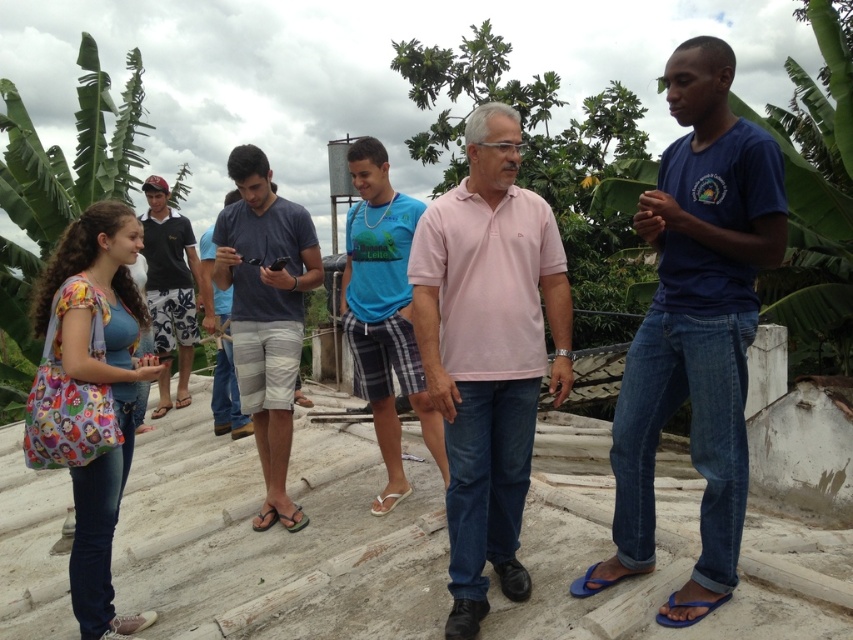
Is dark blue cotton shirt at center in front of blue plaid shorts at center?

No, dark blue cotton shirt at center is further to the viewer.

Is point (268, 307) in front of point (381, 224)?

No, it is behind (381, 224).

Which is in front, point (263, 412) or point (389, 460)?

Positioned in front is point (263, 412).

I want to click on dark blue cotton shirt at center, so click(x=265, y=314).

Who is positioned more to the right, dark blue shirt at left or matte blue shirt at center?

From the viewer's perspective, matte blue shirt at center appears more on the right side.

Is point (178, 218) farther from viewer compared to point (221, 384)?

Yes, point (178, 218) is behind point (221, 384).

The width and height of the screenshot is (853, 640). What are the coordinates of `dark blue shirt at left` in the screenshot? It's located at (169, 289).

Between dark blue shirt at left and white fabric sandal at center, which one appears on the left side from the viewer's perspective?

dark blue shirt at left is more to the left.

In order to click on dark blue shirt at left in this screenshot , I will do `click(169, 289)`.

You are a GUI agent. You are given a task and a screenshot of the screen. Output one action in this format:
    pyautogui.click(x=<x>, y=<y>)
    Task: Click on the dark blue shirt at left
    
    Given the screenshot: What is the action you would take?
    pyautogui.click(x=169, y=289)